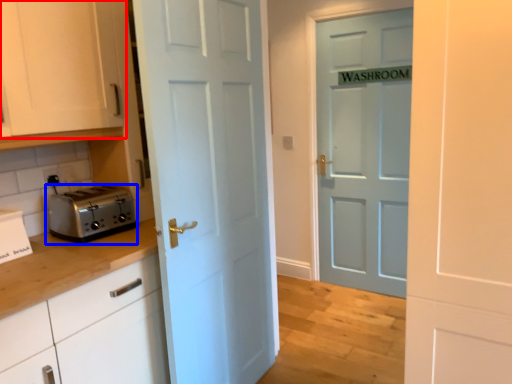
Question: Which point is closer to the camera, cabinetry (highlighted by a red box) or toaster (highlighted by a blue box)?

Choices:
 (A) cabinetry
 (B) toaster

Answer: (A)